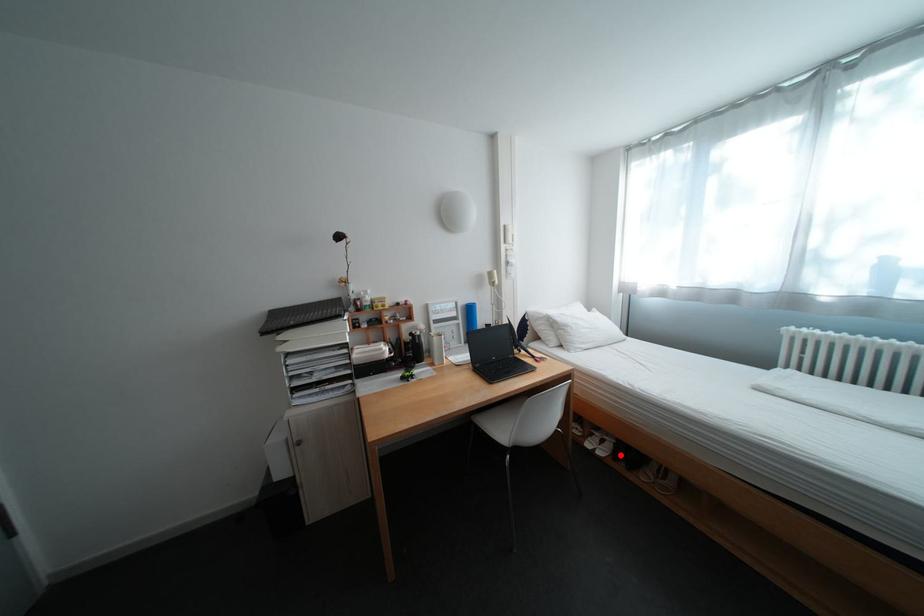
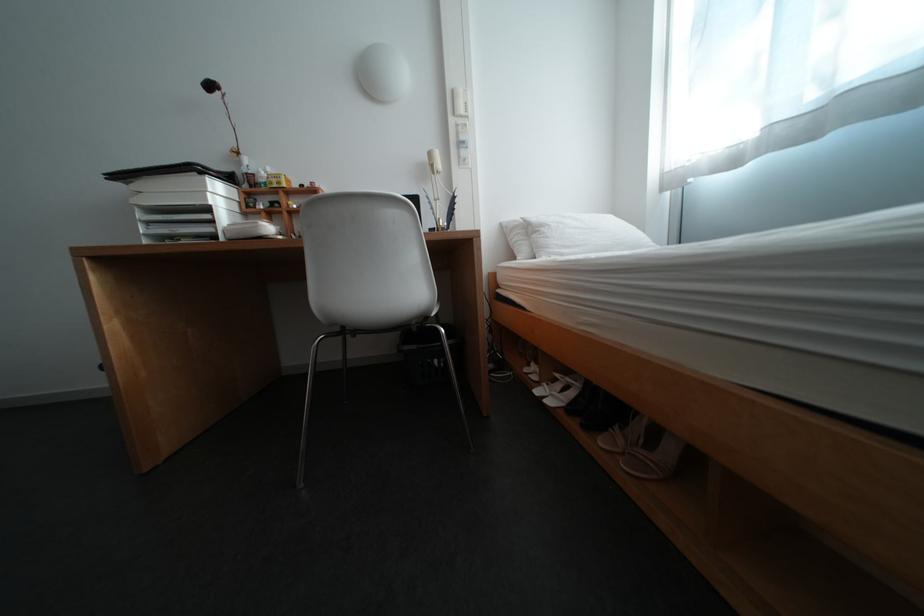
The point at the highlighted location is marked in the first image. Where is the corresponding point in the second image?

(576, 406)